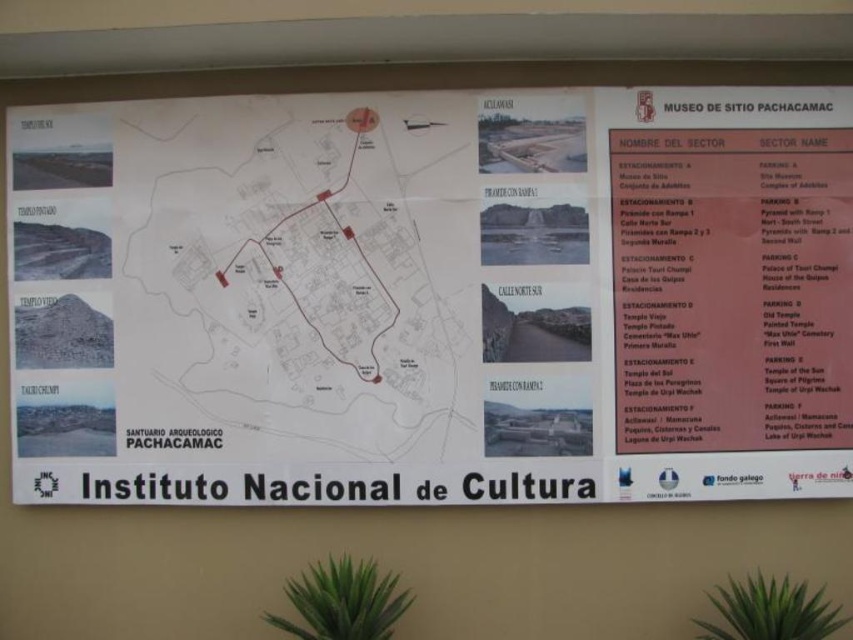
Question: Which object is farther from the camera taking this photo?

Choices:
 (A) white paper map at upper center
 (B) white paper map at center

Answer: (B)

Question: Can you confirm if white paper map at upper center is positioned above white paper map at center?

Choices:
 (A) no
 (B) yes

Answer: (A)

Question: Which of the following is the farthest from the observer?

Choices:
 (A) (837, 470)
 (B) (148, 108)

Answer: (B)

Question: Can you confirm if white paper map at upper center is wider than white paper map at center?

Choices:
 (A) no
 (B) yes

Answer: (B)

Question: In this image, where is white paper map at upper center located relative to white paper map at center?

Choices:
 (A) above
 (B) below

Answer: (B)